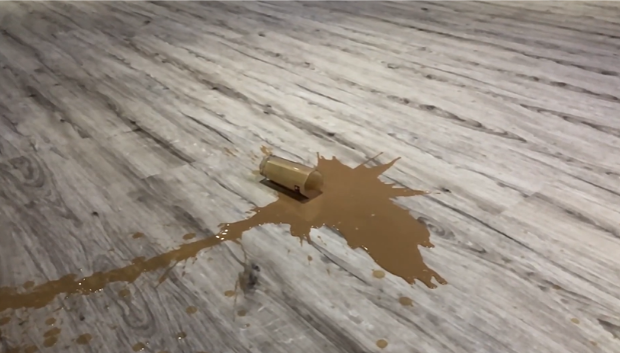
The height and width of the screenshot is (353, 620). I want to click on cup, so click(277, 174).